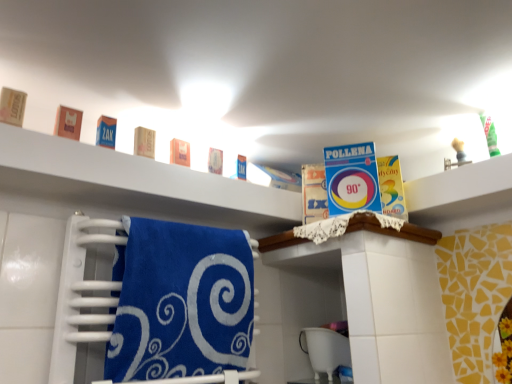
Question: Can you confirm if satin blue towel at lower left is smaller than matte brown soap at left, the 7th product from the right?

Choices:
 (A) no
 (B) yes

Answer: (A)

Question: Is the depth of satin blue towel at lower left greater than that of matte brown soap at left, the first product when ordered from left to right?

Choices:
 (A) no
 (B) yes

Answer: (A)

Question: Is satin blue towel at lower left far away from matte brown soap at left, the 7th product from the right?

Choices:
 (A) no
 (B) yes

Answer: (A)

Question: From a real-world perspective, is satin blue towel at lower left below matte brown soap at left, the 7th product from the right?

Choices:
 (A) no
 (B) yes

Answer: (B)

Question: Is the depth of satin blue towel at lower left less than that of matte brown soap at left, the 7th product from the right?

Choices:
 (A) yes
 (B) no

Answer: (A)

Question: Considering the relative positions of matte brown soap at upper center, the fourth product in the right-to-left sequence, and matte orange soap at center, the 3th product from the right, in the image provided, is matte brown soap at upper center, the fourth product in the right-to-left sequence, to the left or to the right of matte orange soap at center, the 3th product from the right,?

Choices:
 (A) left
 (B) right

Answer: (A)

Question: From a real-world perspective, is matte brown soap at upper center, the fourth product in the right-to-left sequence, above or below matte orange soap at center, arranged as the 5th product when viewed from the left?

Choices:
 (A) below
 (B) above

Answer: (A)

Question: From the image's perspective, is matte brown soap at upper center, the 4th product when ordered from left to right, positioned above or below matte orange soap at center, arranged as the 5th product when viewed from the left?

Choices:
 (A) above
 (B) below

Answer: (A)

Question: In terms of height, does matte brown soap at upper center, the 4th product when ordered from left to right, look taller or shorter compared to matte orange soap at center, the 3th product from the right?

Choices:
 (A) short
 (B) tall

Answer: (A)

Question: Visually, is white matte shelf at upper center, which ranks as the first shelf in left-to-right order, positioned to the left or to the right of satin blue towel at lower left?

Choices:
 (A) right
 (B) left

Answer: (B)

Question: From a real-world perspective, is white matte shelf at upper center, which ranks as the first shelf in left-to-right order, above or below satin blue towel at lower left?

Choices:
 (A) above
 (B) below

Answer: (A)

Question: Looking at the image, does white matte shelf at upper center, which ranks as the first shelf in left-to-right order, seem bigger or smaller compared to satin blue towel at lower left?

Choices:
 (A) small
 (B) big

Answer: (B)

Question: Considering their positions, is white matte shelf at upper center, which ranks as the first shelf in left-to-right order, located in front of or behind satin blue towel at lower left?

Choices:
 (A) front
 (B) behind

Answer: (A)

Question: Is yellow cardboard box at upper right, marked as the seventh product in a left-to-right arrangement, in front of or behind matte brown soap at left, the 7th product from the right, in the image?

Choices:
 (A) behind
 (B) front

Answer: (A)

Question: Is yellow cardboard box at upper right, marked as the seventh product in a left-to-right arrangement, wider or thinner than matte brown soap at left, the 7th product from the right?

Choices:
 (A) thin
 (B) wide

Answer: (B)